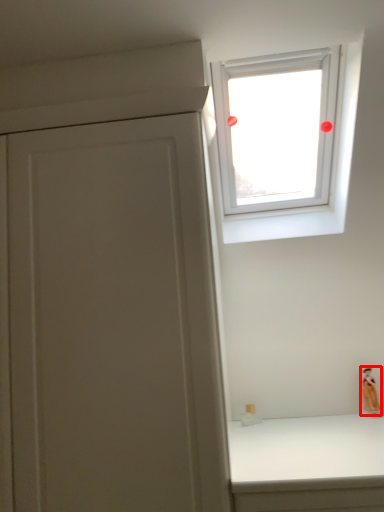
Question: From the image's perspective, considering the relative positions of figurine (annotated by the red box) and window in the image provided, where is figurine (annotated by the red box) located with respect to the staircase?

Choices:
 (A) above
 (B) below

Answer: (B)